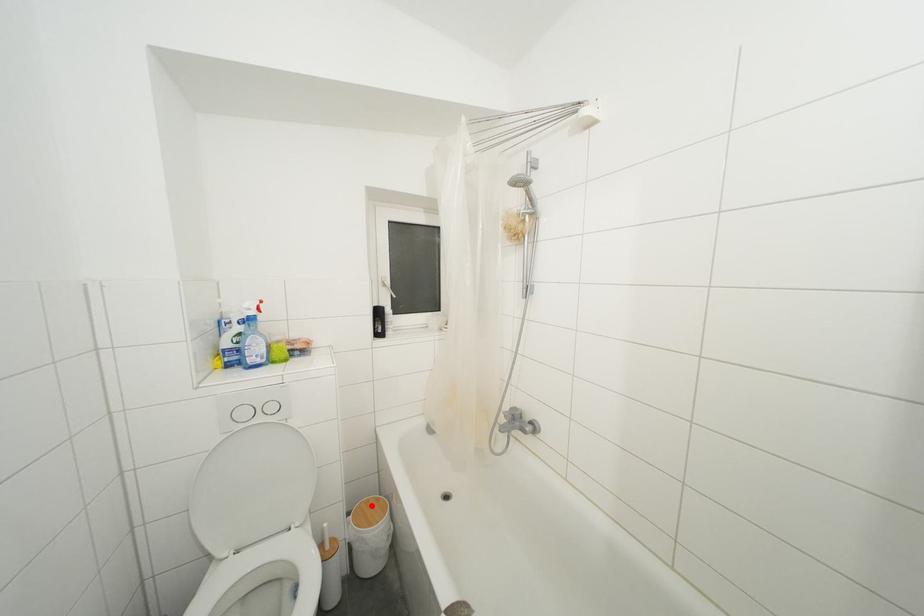
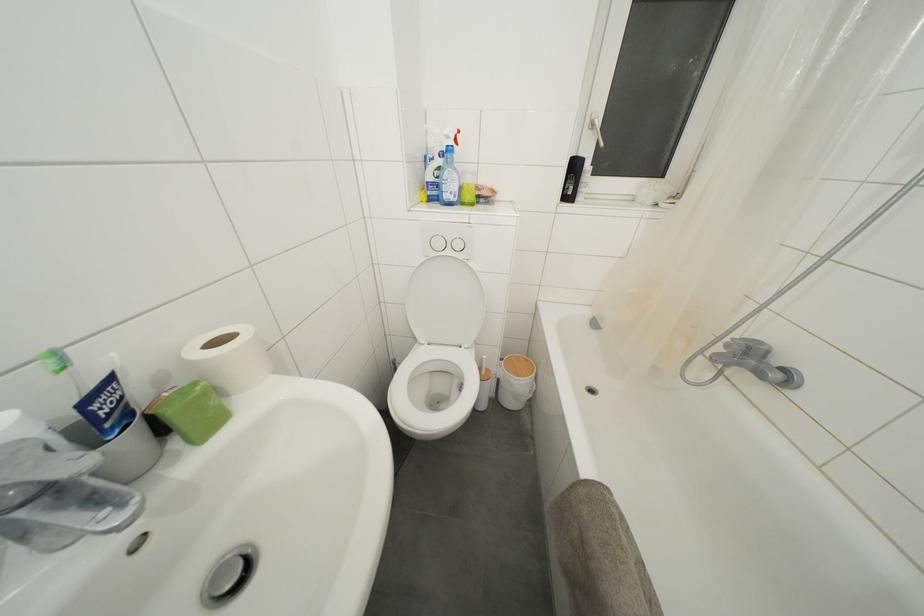
Find the pixel in the second image that matches the highlighted location in the first image.

(521, 362)